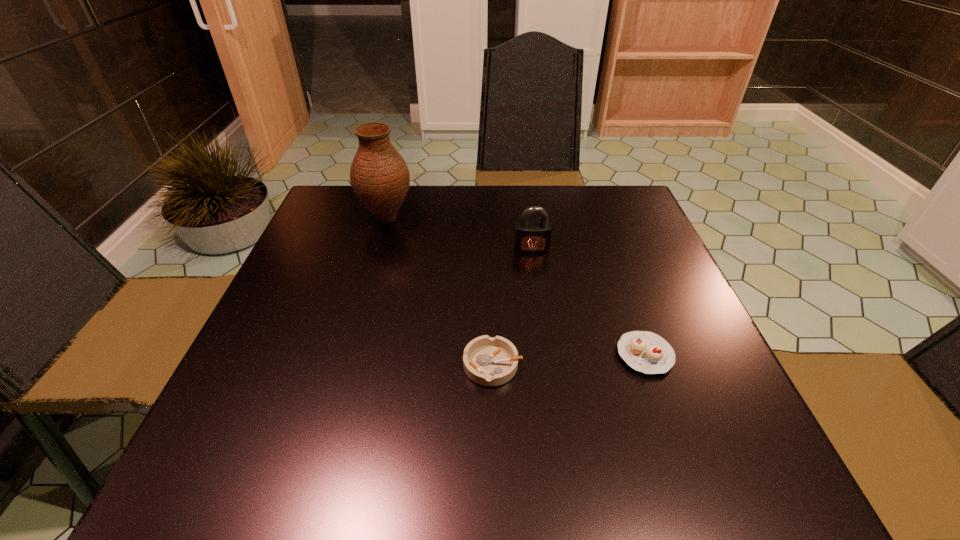
At what (x,y) coordinates should I click in order to perform the action: click on vacant space located on the back of the rightmost object. Please return your answer as a coordinate pair (x, y). This screenshot has height=540, width=960. Looking at the image, I should click on [x=602, y=234].

Where is `free space located on the back of the second object from left to right`? This screenshot has width=960, height=540. free space located on the back of the second object from left to right is located at coordinates (491, 304).

This screenshot has height=540, width=960. I want to click on object present at the far edge, so click(379, 176).

This screenshot has width=960, height=540. What are the coordinates of `object at the left edge` in the screenshot? It's located at (379, 176).

At what (x,y) coordinates should I click in order to perform the action: click on object at the right edge. Please return your answer as a coordinate pair (x, y). The height and width of the screenshot is (540, 960). Looking at the image, I should click on (644, 351).

At what (x,y) coordinates should I click in order to perform the action: click on object that is at the far left corner. Please return your answer as a coordinate pair (x, y). Looking at the image, I should click on (379, 176).

This screenshot has width=960, height=540. In order to click on vacant space at the far edge of the desktop in this screenshot , I will do `click(538, 205)`.

Find the location of a particular element. vacant space at the near edge of the desktop is located at coordinates (646, 495).

In the image, there is a desktop. Where is `free space at the left edge`? free space at the left edge is located at coordinates (230, 387).

You are a GUI agent. You are given a task and a screenshot of the screen. Output one action in this format:
    pyautogui.click(x=<x>, y=<y>)
    Task: Click on the vacant space at the right edge of the desktop
    
    Given the screenshot: What is the action you would take?
    pyautogui.click(x=669, y=295)